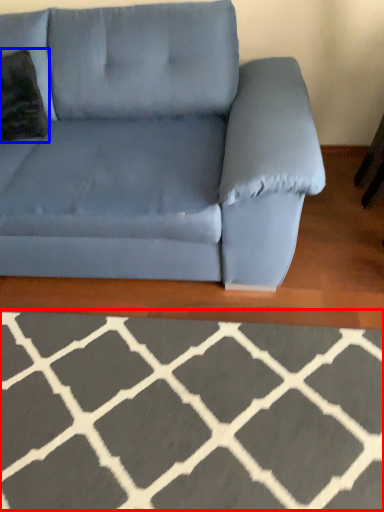
Question: Among these objects, which one is nearest to the camera, furniture (highlighted by a red box) or throw pillow (highlighted by a blue box)?

Choices:
 (A) furniture
 (B) throw pillow

Answer: (A)